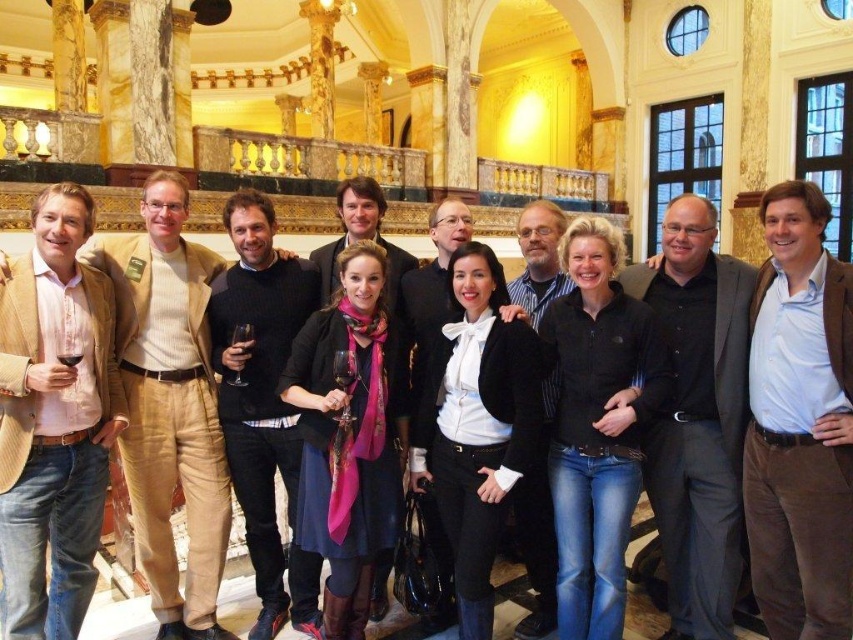
Does black matte suit at center have a smaller size compared to black fleece jacket at center?

Incorrect, black matte suit at center is not smaller in size than black fleece jacket at center.

Who is lower down, black matte suit at center or black fleece jacket at center?

black fleece jacket at center is below.

Which is in front, point (682, 566) or point (646, 342)?

Positioned in front is point (646, 342).

Where is `black matte suit at center`? black matte suit at center is located at coordinates (698, 417).

Can you confirm if matte beige blazer at left is bigger than black fleece jacket at center?

Incorrect, matte beige blazer at left is not larger than black fleece jacket at center.

Is matte beige blazer at left further to camera compared to black fleece jacket at center?

No.

Identify the location of matte beige blazer at left. This screenshot has height=640, width=853. (54, 420).

In order to click on matte beige blazer at left in this screenshot , I will do `click(54, 420)`.

Is point (648, 288) positioned before point (235, 378)?

That is False.

Is black matte suit at center thinner than black sweater at center?

Yes.

At what (x,y) coordinates should I click in order to perform the action: click on black matte suit at center. Please return your answer as a coordinate pair (x, y). The height and width of the screenshot is (640, 853). Looking at the image, I should click on (698, 417).

Where is `black matte suit at center`? This screenshot has width=853, height=640. black matte suit at center is located at coordinates (698, 417).